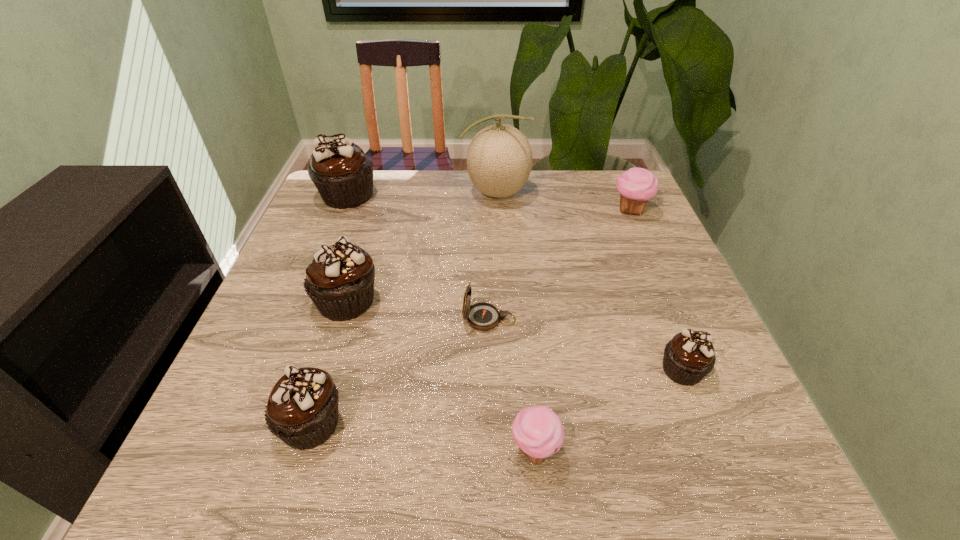
Find the location of a particular element. The height and width of the screenshot is (540, 960). cantaloup is located at coordinates (499, 160).

Image resolution: width=960 pixels, height=540 pixels. Identify the location of the second tallest object. (343, 175).

Where is `the tallest cupcake`? This screenshot has height=540, width=960. the tallest cupcake is located at coordinates (343, 175).

Where is `the fourth nearest cupcake`? This screenshot has width=960, height=540. the fourth nearest cupcake is located at coordinates (339, 280).

Find the location of a particular element. This screenshot has height=540, width=960. the fifth shortest cupcake is located at coordinates (339, 280).

The width and height of the screenshot is (960, 540). Find the location of `the farther pink cupcake`. the farther pink cupcake is located at coordinates (636, 186).

The image size is (960, 540). I want to click on the right pink cupcake, so click(636, 186).

Where is `the second smallest brown cupcake`? The image size is (960, 540). the second smallest brown cupcake is located at coordinates coord(302,409).

The width and height of the screenshot is (960, 540). Identify the location of compass. (482, 316).

This screenshot has height=540, width=960. I want to click on the fourth farthest cupcake, so click(689, 356).